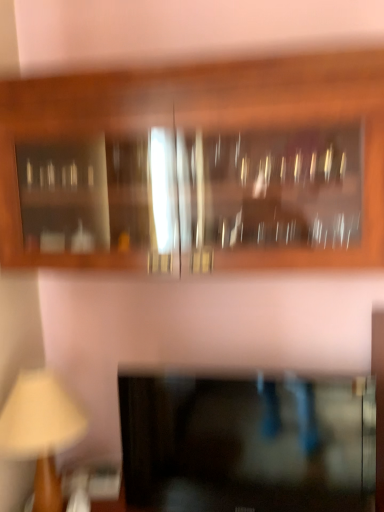
Question: Is wooden beige table lamp at lower left positioned far away from wooden cabinet at upper center, marked as the 1th cabinetry in a top-to-bottom arrangement?

Choices:
 (A) no
 (B) yes

Answer: (A)

Question: From a real-world perspective, is wooden beige table lamp at lower left over wooden cabinet at upper center, the second cabinetry from the bottom?

Choices:
 (A) yes
 (B) no

Answer: (B)

Question: Can you confirm if wooden beige table lamp at lower left is smaller than wooden cabinet at upper center, marked as the 1th cabinetry in a top-to-bottom arrangement?

Choices:
 (A) yes
 (B) no

Answer: (A)

Question: From the image's perspective, would you say wooden beige table lamp at lower left is positioned over wooden cabinet at upper center, marked as the 1th cabinetry in a top-to-bottom arrangement?

Choices:
 (A) no
 (B) yes

Answer: (A)

Question: Is wooden beige table lamp at lower left touching wooden cabinet at upper center, marked as the 1th cabinetry in a top-to-bottom arrangement?

Choices:
 (A) yes
 (B) no

Answer: (B)

Question: Looking at their shapes, would you say black glass cabinet at lower center, the first cabinetry ordered from the bottom, is wider or thinner than wooden beige table lamp at lower left?

Choices:
 (A) thin
 (B) wide

Answer: (A)

Question: In terms of size, does black glass cabinet at lower center, which ranks as the second cabinetry in top-to-bottom order, appear bigger or smaller than wooden beige table lamp at lower left?

Choices:
 (A) big
 (B) small

Answer: (A)

Question: From the image's perspective, relative to wooden beige table lamp at lower left, is black glass cabinet at lower center, which ranks as the second cabinetry in top-to-bottom order, above or below?

Choices:
 (A) below
 (B) above

Answer: (B)

Question: Choose the correct answer: Is black glass cabinet at lower center, which ranks as the second cabinetry in top-to-bottom order, inside wooden beige table lamp at lower left or outside it?

Choices:
 (A) outside
 (B) inside

Answer: (A)

Question: Is wooden cabinet at upper center, marked as the 1th cabinetry in a top-to-bottom arrangement, in front of or behind black glass cabinet at lower center, which ranks as the second cabinetry in top-to-bottom order, in the image?

Choices:
 (A) behind
 (B) front

Answer: (B)

Question: Is point (236, 64) closer or farther from the camera than point (201, 467)?

Choices:
 (A) farther
 (B) closer

Answer: (B)

Question: Based on their sizes in the image, would you say wooden cabinet at upper center, marked as the 1th cabinetry in a top-to-bottom arrangement, is bigger or smaller than black glass cabinet at lower center, the first cabinetry ordered from the bottom?

Choices:
 (A) small
 (B) big

Answer: (B)

Question: In terms of height, does wooden cabinet at upper center, the second cabinetry from the bottom, look taller or shorter compared to black glass cabinet at lower center, the first cabinetry ordered from the bottom?

Choices:
 (A) short
 (B) tall

Answer: (B)

Question: Considering the positions of wooden cabinet at upper center, marked as the 1th cabinetry in a top-to-bottom arrangement, and wooden beige table lamp at lower left in the image, is wooden cabinet at upper center, marked as the 1th cabinetry in a top-to-bottom arrangement, taller or shorter than wooden beige table lamp at lower left?

Choices:
 (A) short
 (B) tall

Answer: (B)

Question: Is wooden cabinet at upper center, the second cabinetry from the bottom, to the left or to the right of wooden beige table lamp at lower left in the image?

Choices:
 (A) left
 (B) right

Answer: (B)